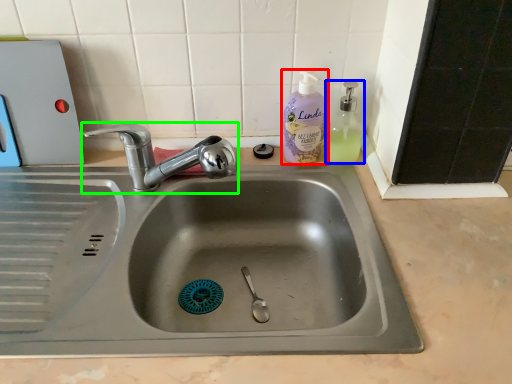
Question: Which object is positioned closest to cleaning product (highlighted by a red box)? Select from soap dispenser (highlighted by a blue box) and tap (highlighted by a green box).

Choices:
 (A) soap dispenser
 (B) tap

Answer: (A)